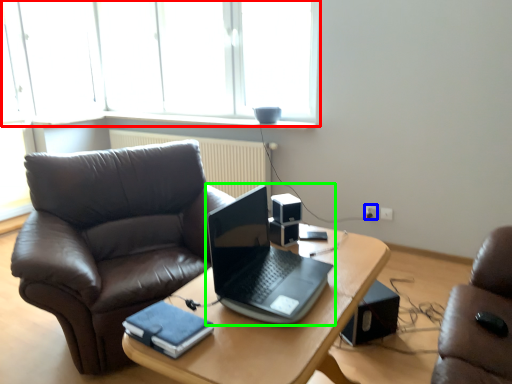
Question: Which object is the farthest from window (highlighted by a red box)? Choose among these: power outlet (highlighted by a blue box) or laptop (highlighted by a green box).

Choices:
 (A) power outlet
 (B) laptop

Answer: (B)